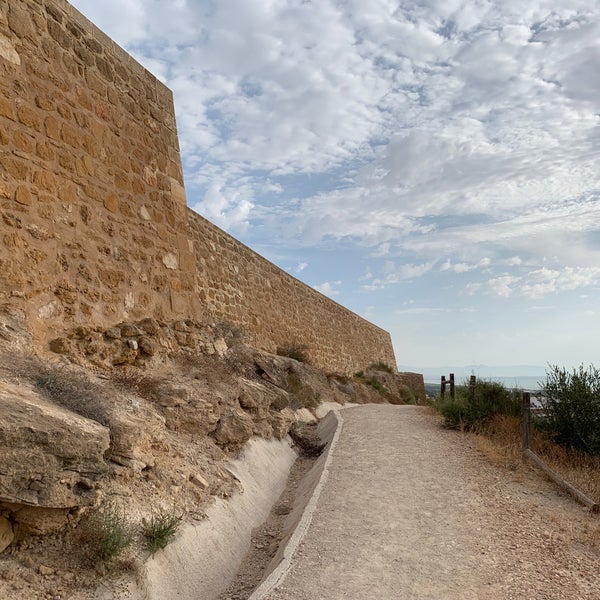
At what (x,y) coordinates should I click in order to perform the action: click on brown stone wall. Please return your answer as a coordinate pair (x, y). Image resolution: width=600 pixels, height=600 pixels. Looking at the image, I should click on coord(413,380), coord(284,322), coord(116,272).